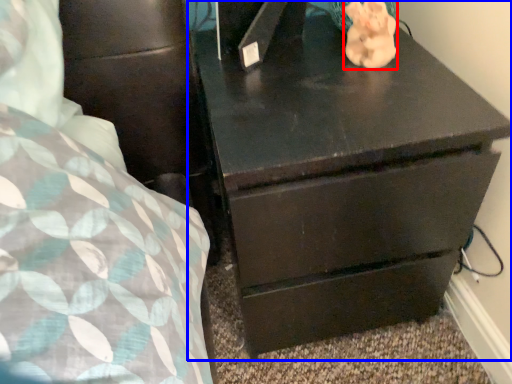
Question: Which object appears farthest to the camera in this image, animal (highlighted by a red box) or chest of drawers (highlighted by a blue box)?

Choices:
 (A) animal
 (B) chest of drawers

Answer: (A)